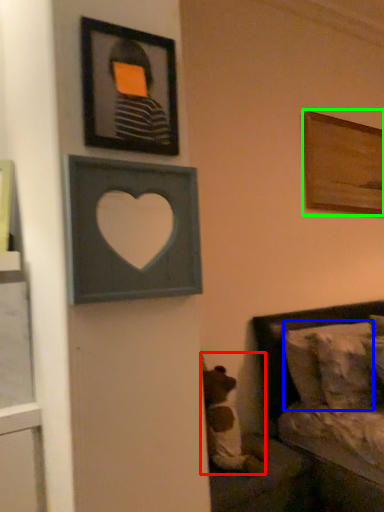
Question: Considering the real-world distances, which object is closest to animal (highlighted by a red box)? pillow (highlighted by a blue box) or picture frame (highlighted by a green box).

Choices:
 (A) pillow
 (B) picture frame

Answer: (A)